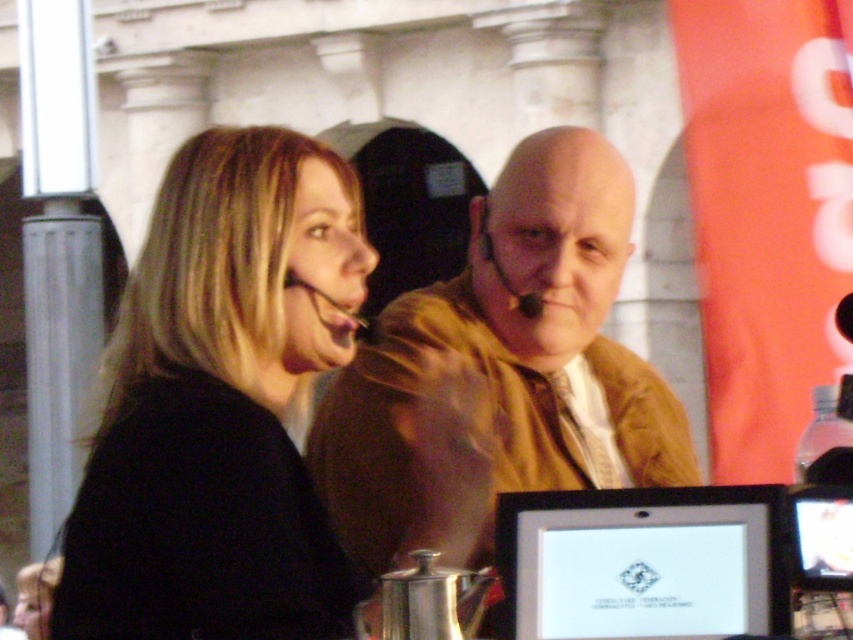
Question: Can you confirm if black matte jacket at center is thinner than silver metallic laptop at center?

Choices:
 (A) no
 (B) yes

Answer: (A)

Question: Does brown leather jacket at center have a larger size compared to silver metallic laptop at center?

Choices:
 (A) yes
 (B) no

Answer: (A)

Question: Which point is closer to the camera?

Choices:
 (A) silver metallic laptop at center
 (B) black matte jacket at center

Answer: (B)

Question: Which point appears closest to the camera in this image?

Choices:
 (A) 242,513
 (B) 671,557

Answer: (B)

Question: Which object is the farthest from the brown leather jacket at center?

Choices:
 (A) black matte jacket at center
 (B) silver metallic laptop at center

Answer: (B)

Question: Is black matte jacket at center positioned before brown leather jacket at center?

Choices:
 (A) no
 (B) yes

Answer: (B)